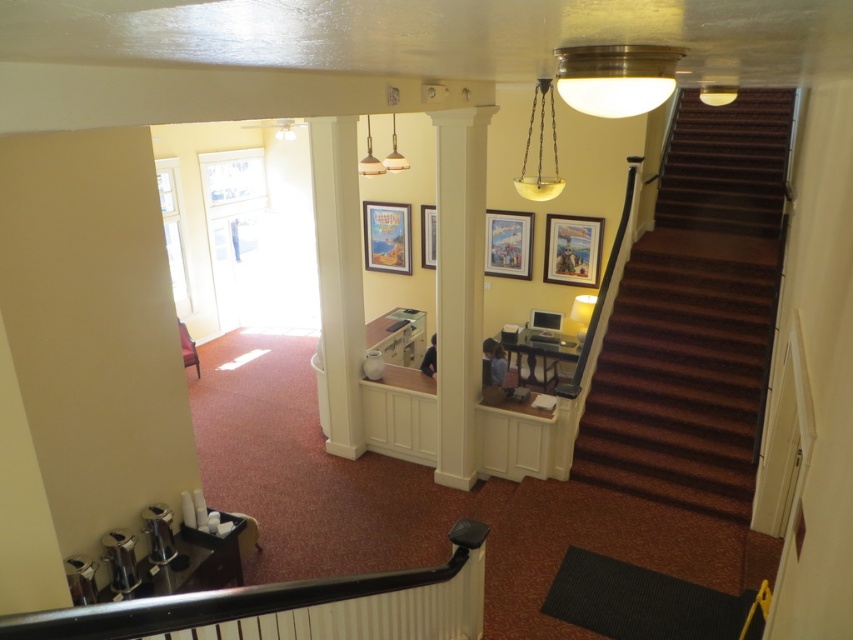
Question: Is white glossy column at center behind wooden picture frame at center?

Choices:
 (A) yes
 (B) no

Answer: (B)

Question: Is matte plastic picture frame at center smaller than matte wooden picture frame at center?

Choices:
 (A) yes
 (B) no

Answer: (B)

Question: Which is nearer to the brown carpeted stairs at right?

Choices:
 (A) matte wooden picture frame at center
 (B) wooden picture frame at upper center
 (C) wooden picture frame at center

Answer: (B)

Question: Considering the real-world distances, which object is farthest from the white glossy column at center?

Choices:
 (A) wooden picture frame at center
 (B) white smooth column at center

Answer: (A)

Question: Does wooden picture frame at upper center appear on the right side of wooden picture frame at center?

Choices:
 (A) no
 (B) yes

Answer: (B)

Question: Which object is positioned closest to the wooden picture frame at upper center?

Choices:
 (A) white smooth column at center
 (B) brown carpeted stairs at right
 (C) black plastic handrail at lower center
 (D) matte wooden picture frame at center

Answer: (D)